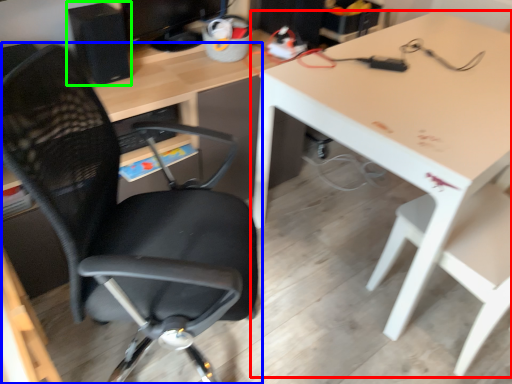
Question: Based on their relative distances, which object is nearer to table (highlighted by a red box)? Choose from chair (highlighted by a blue box) and computer tower (highlighted by a green box).

Choices:
 (A) chair
 (B) computer tower

Answer: (A)